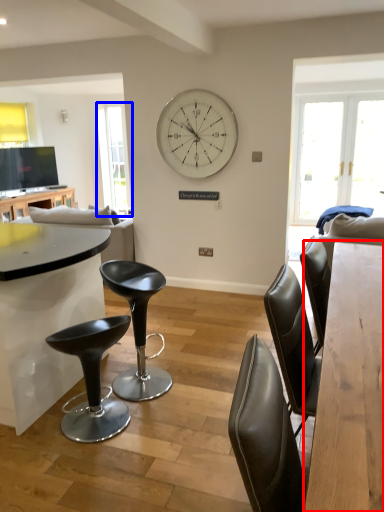
Question: Which of the following is the farthest to the observer, table (highlighted by a red box) or window screen (highlighted by a blue box)?

Choices:
 (A) table
 (B) window screen

Answer: (B)